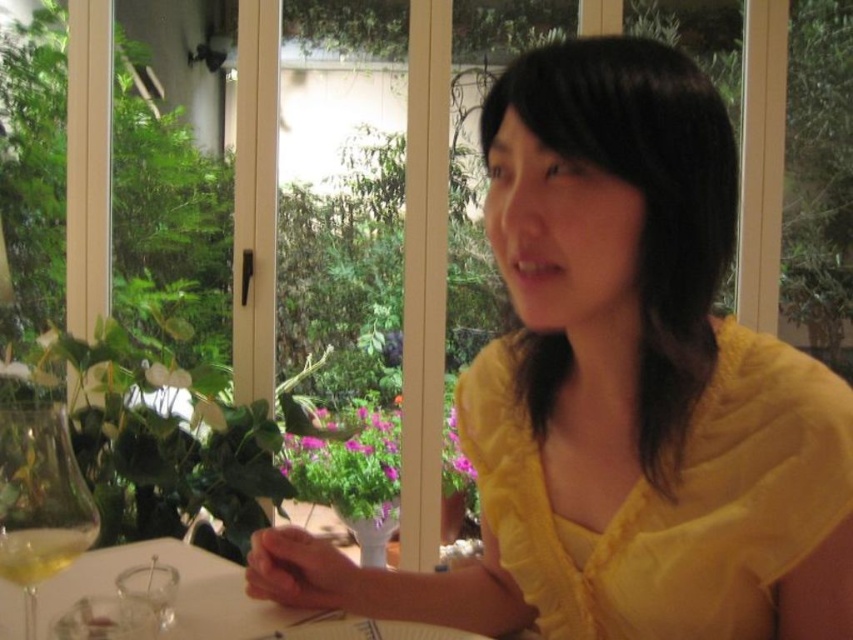
Question: Based on their relative distances, which object is farther from the yellow cotton dress at center?

Choices:
 (A) white glossy table at center
 (B) yellow fabric shirt at center
 (C) clear glass wine glass at lower left

Answer: (C)

Question: Which object is closer to the camera taking this photo?

Choices:
 (A) clear glass wine glass at lower left
 (B) white glossy table at center

Answer: (A)

Question: Which point is closer to the camera?

Choices:
 (A) (82, 547)
 (B) (207, 572)
 (C) (654, 528)

Answer: (C)

Question: Is yellow fabric shirt at center to the left of white glossy table at center from the viewer's perspective?

Choices:
 (A) no
 (B) yes

Answer: (A)

Question: Does clear glass wine glass at lower left appear under translucent glass wine at lower left?

Choices:
 (A) yes
 (B) no

Answer: (A)

Question: Where is clear glass wine glass at lower left located in relation to white glossy table at center in the image?

Choices:
 (A) right
 (B) left

Answer: (B)